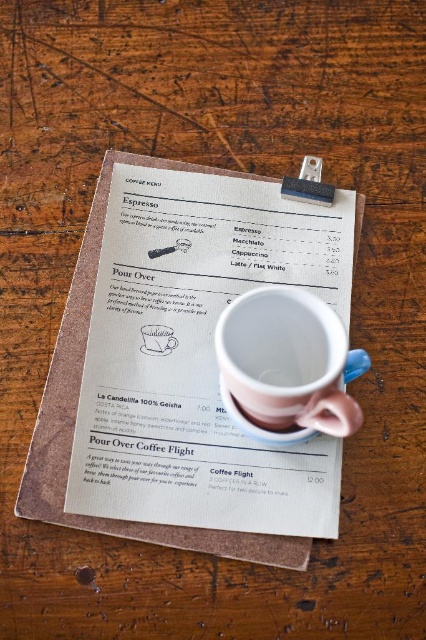
Question: Which point is closer to the camera?

Choices:
 (A) (131, 243)
 (B) (141, 326)
 (C) (161, 344)
 (D) (264, 314)

Answer: (D)

Question: Based on their relative distances, which object is farther from the pink ceramic cup at center?

Choices:
 (A) pink matte mug at center
 (B) pink matte saucer at center
 (C) white paper receipt at center

Answer: (B)

Question: Observing the image, what is the correct spatial positioning of pink matte mug at center in reference to pink matte saucer at center?

Choices:
 (A) below
 (B) above

Answer: (B)

Question: Can you confirm if pink matte mug at center is positioned to the left of pink matte saucer at center?

Choices:
 (A) no
 (B) yes

Answer: (B)

Question: Is pink ceramic cup at center smaller than pink matte mug at center?

Choices:
 (A) no
 (B) yes

Answer: (A)

Question: Based on their relative distances, which object is nearer to the pink matte mug at center?

Choices:
 (A) white paper receipt at center
 (B) pink ceramic cup at center
 (C) pink matte saucer at center

Answer: (C)